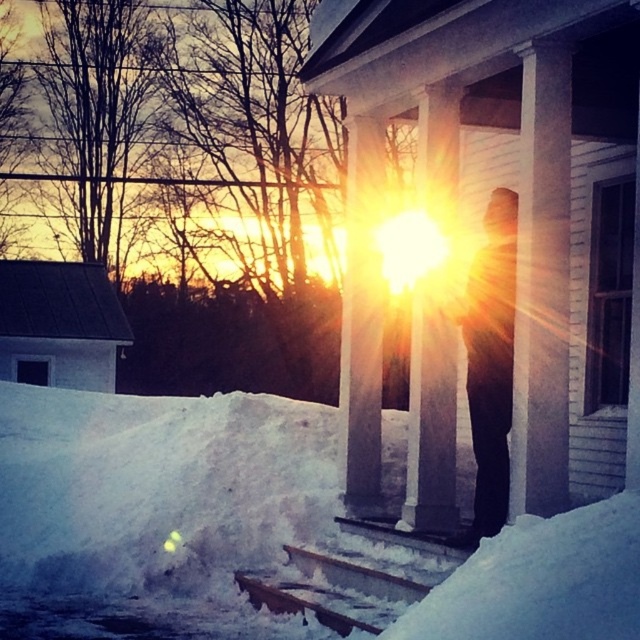
Looking at this image, who is positioned more to the left, white powdery snow at lower left or black matte figure at center?

white powdery snow at lower left is more to the left.

Is white powdery snow at lower left positioned behind black matte figure at center?

No, it is not.

Between point (312, 628) and point (502, 246), which one is positioned behind?

Positioned behind is point (502, 246).

Where is `white powdery snow at lower left`? white powdery snow at lower left is located at coordinates pos(257,531).